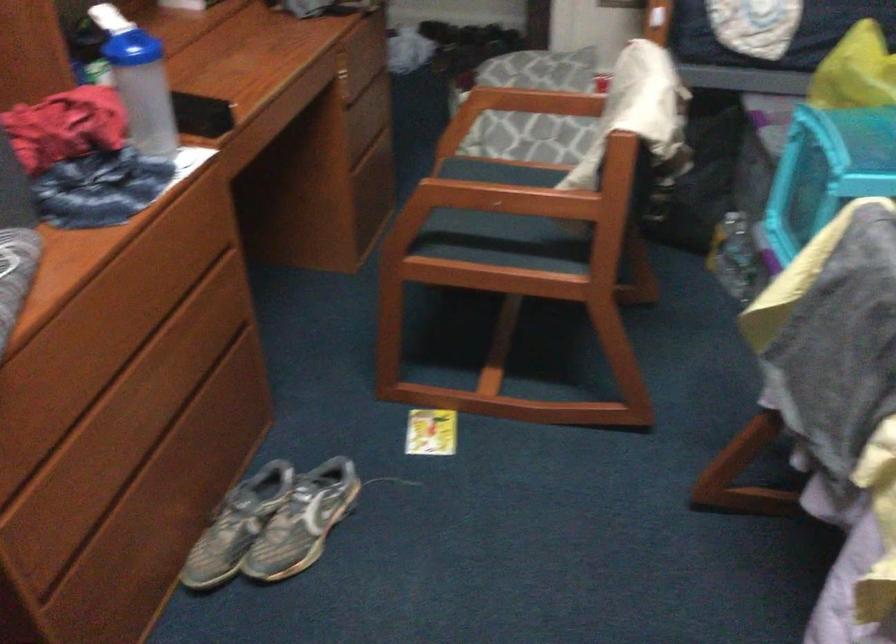
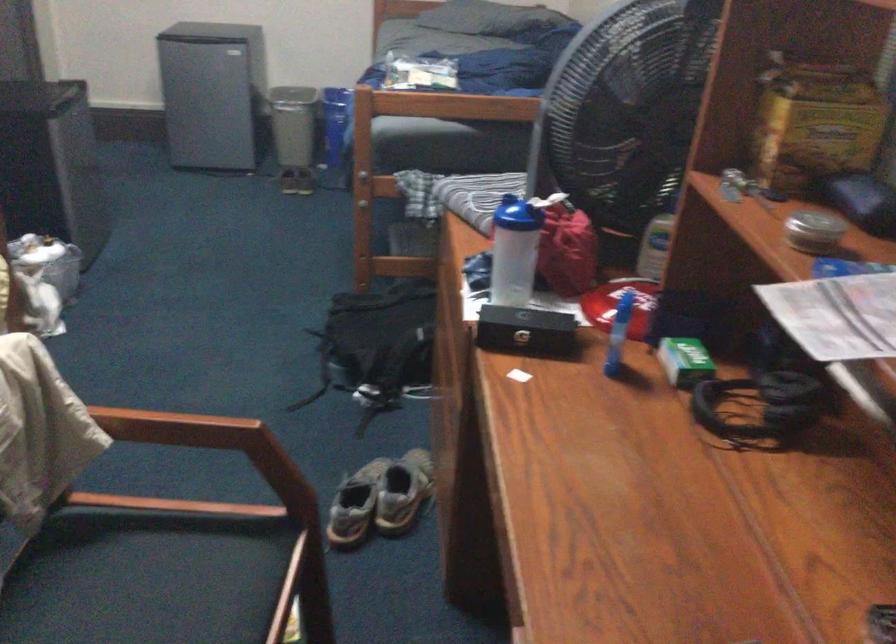
The point at (254,514) is marked in the first image. Where is the corresponding point in the second image?

(402, 491)